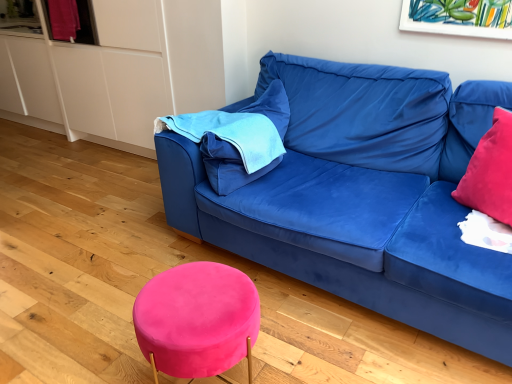
Image resolution: width=512 pixels, height=384 pixels. I want to click on vacant space situated above velvet pink stool at lower center (from a real-world perspective), so click(x=201, y=292).